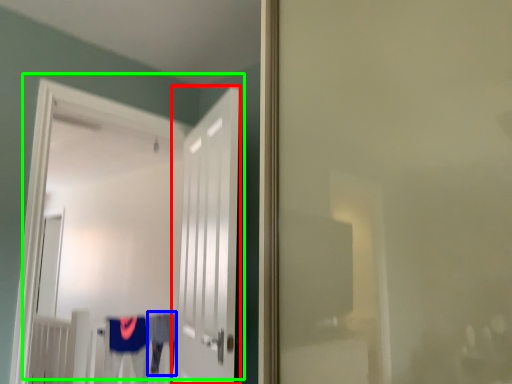
Question: Based on their relative distances, which object is nearer to door (highlighted by a red box)? Choose from robe (highlighted by a blue box) and door (highlighted by a green box).

Choices:
 (A) robe
 (B) door

Answer: (A)